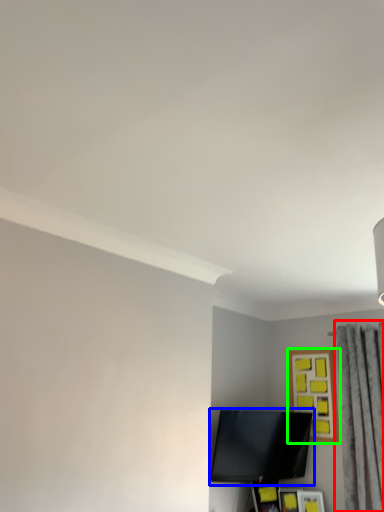
Question: Based on their relative distances, which object is farther from curtain (highlighted by a red box)? Choose from television (highlighted by a blue box) and picture frame (highlighted by a green box).

Choices:
 (A) television
 (B) picture frame

Answer: (A)